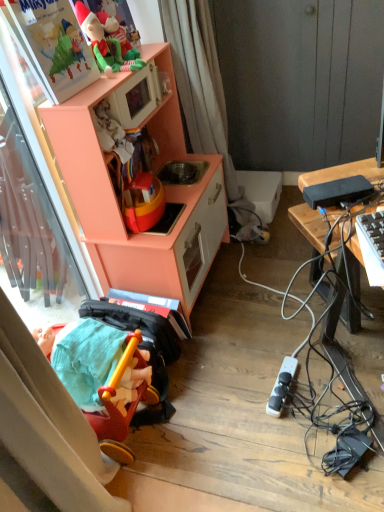
What are the coordinates of `free space to the left of black plastic desk at right` in the screenshot? It's located at (259, 313).